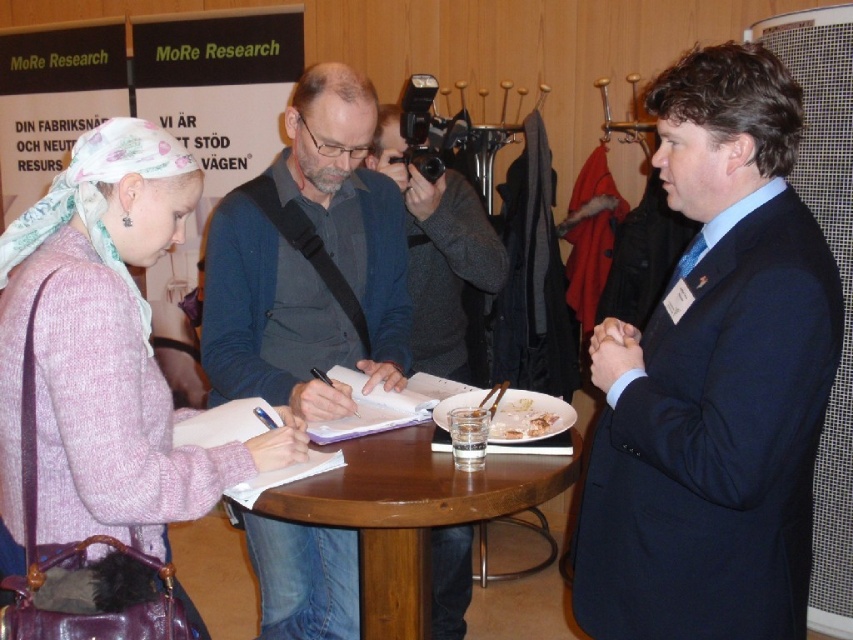
Consider the image. You are standing at the center of the room and want to reach the point marked as point (51, 280). Which direction should you move relative to point (374, 284)?

You should move towards the front direction relative to point (374, 284) because point (51, 280) is in front of it.

You are standing in front of the round wooden table in the scene. There are two points marked on the table surface. The first point is at coordinates point (624, 634) and the second is at point (103, 284). Which point is closer to you?

Point (624, 634) is closer to you because it is further to the viewer than point (103, 284).

You are a photographer positioned in front of the scene. You want to capture a closeup shot of the pink knitted sweater at center. Given that your camera can focus clearly on objects within 4 feet, will the sweater be in focus?

The distance of pink knitted sweater at center from camera is 3.87 feet, which is within the 4 feet focus range, so the sweater will be in focus.